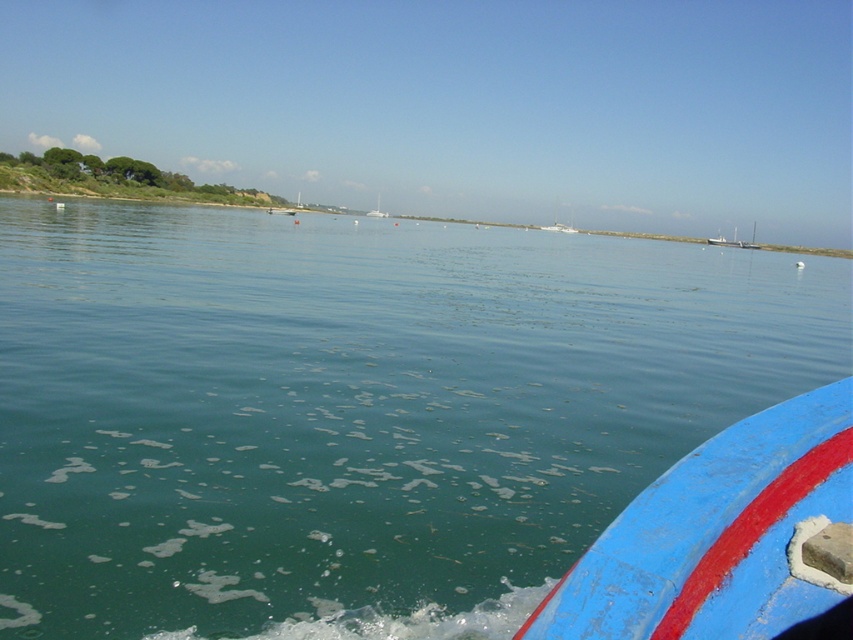
You are on a boat trip and notice the blue painted wood boat at lower right and the white glossy sailboat at center. Which boat is closer to you?

The blue painted wood boat at lower right is closer to you because it is positioned in front of the white glossy sailboat at center.

In the scene shown: You are standing on the deck of the blue and red boat in the foreground. You want to throw a floating marker into the water to track your position. Where should you aim to place the marker so it stays in the green matte water at center?

You should aim to place the marker at point (x=355, y=410) to ensure it stays in the green matte water at center.